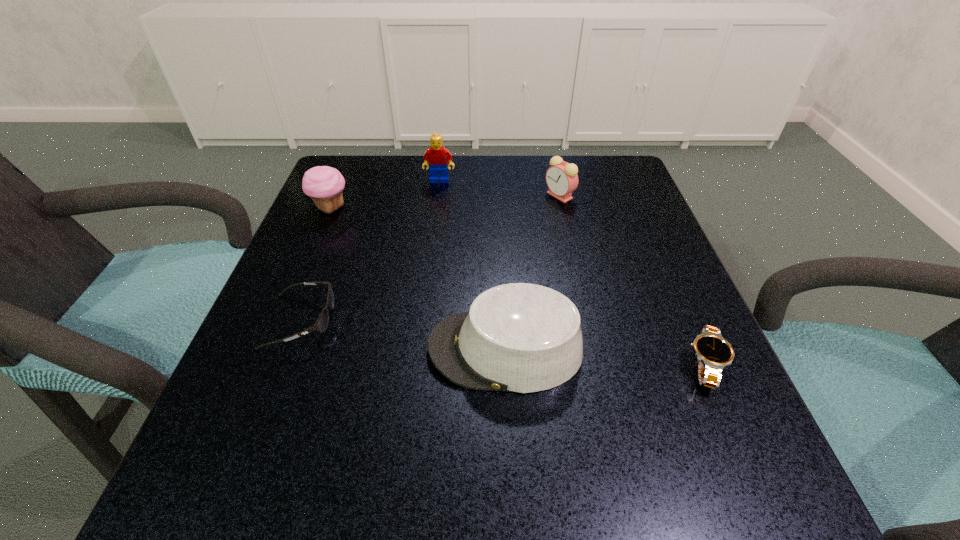
The height and width of the screenshot is (540, 960). Find the location of `alarm clock present at the far edge`. alarm clock present at the far edge is located at coordinates (562, 179).

Locate an element on the screen. cupcake at the left edge is located at coordinates (324, 184).

Locate an element on the screen. The image size is (960, 540). sunglasses positioned at the left edge is located at coordinates (321, 324).

What are the coordinates of `alarm clock at the right edge` in the screenshot? It's located at (562, 179).

The height and width of the screenshot is (540, 960). In order to click on watch that is at the right edge in this screenshot , I will do `click(714, 353)`.

I want to click on object present at the far left corner, so click(x=324, y=184).

Where is `object at the far right corner`? The width and height of the screenshot is (960, 540). object at the far right corner is located at coordinates (562, 179).

This screenshot has width=960, height=540. In the image, there is a desktop. Identify the location of blank space at the far edge. (543, 195).

The image size is (960, 540). What are the coordinates of `blank space at the near edge of the desktop` in the screenshot? It's located at tap(369, 449).

This screenshot has height=540, width=960. Identify the location of vacant position at the left edge of the desktop. (323, 338).